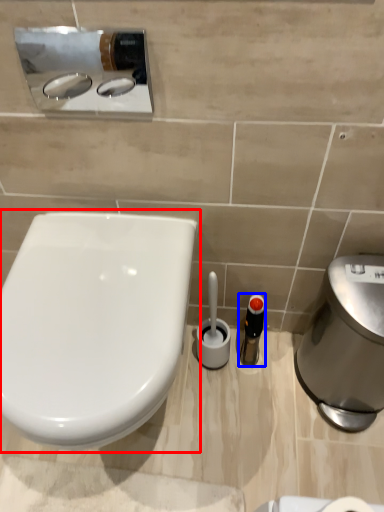
Question: Which point is further to the camera, toilet (highlighted by a red box) or toiletry (highlighted by a blue box)?

Choices:
 (A) toilet
 (B) toiletry

Answer: (B)